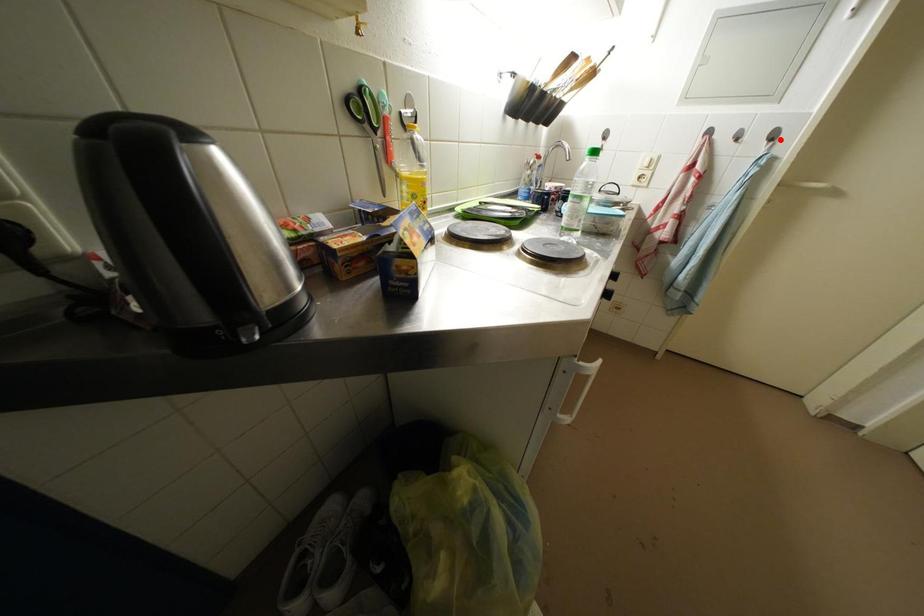
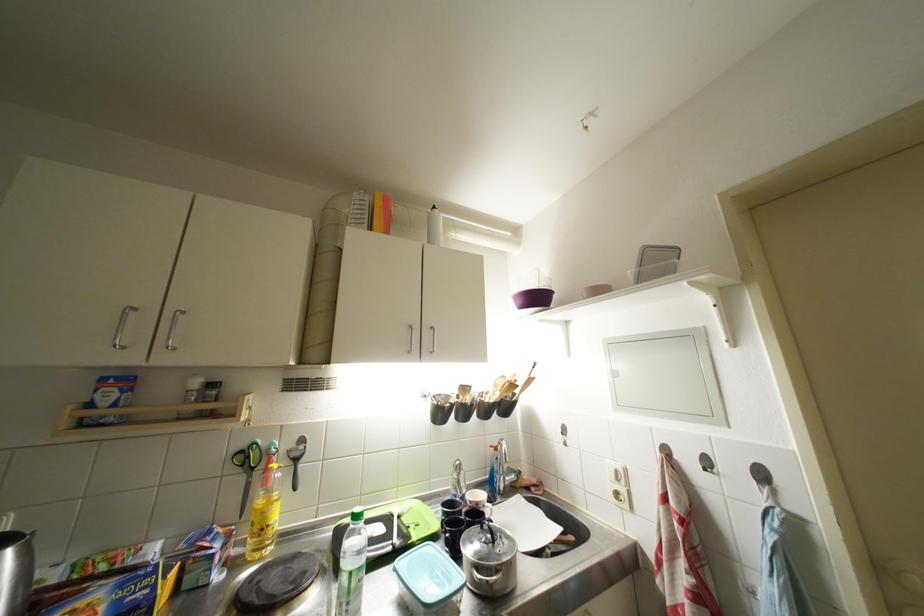
Where in the second image is the point corresponding to the highlighted location from the first image?

(769, 479)